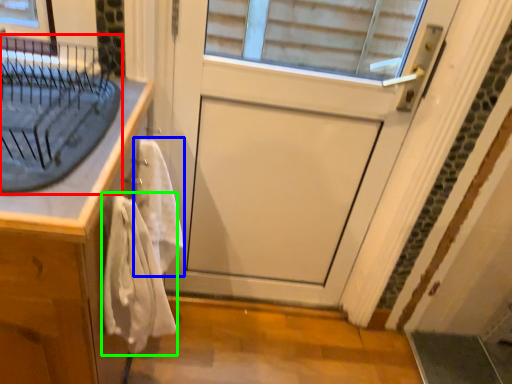
Question: Considering the real-world distances, which object is farthest from sink (highlighted by a red box)? bath towel (highlighted by a blue box) or bath towel (highlighted by a green box)?

Choices:
 (A) bath towel
 (B) bath towel

Answer: (B)